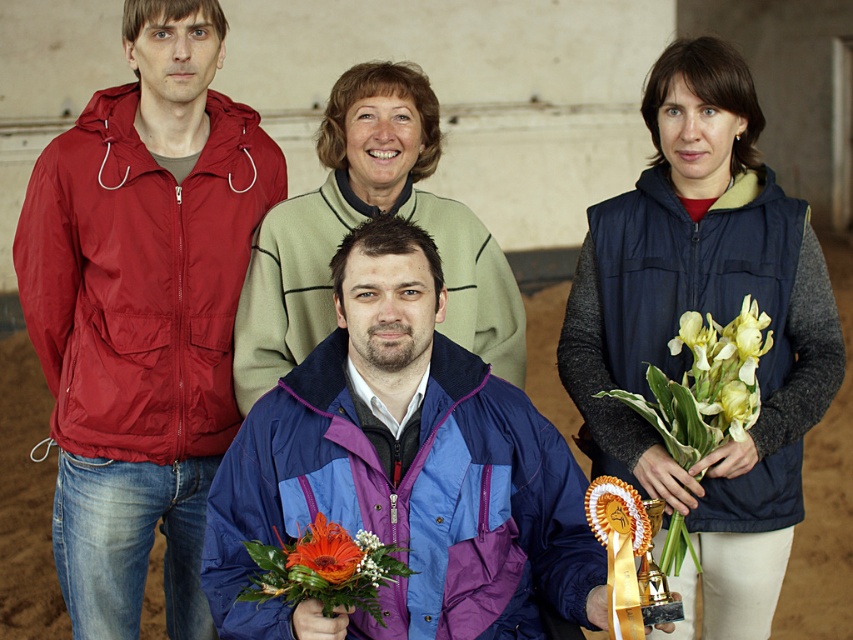
Question: Can you confirm if blue-purple nylon jacket at center is positioned below yellow-green floral bouquet at right?

Choices:
 (A) yes
 (B) no

Answer: (A)

Question: In this image, where is blue-purple nylon jacket at center located relative to matte green sweater at upper center?

Choices:
 (A) above
 (B) below

Answer: (B)

Question: Which point is farther from the camera taking this photo?

Choices:
 (A) (677, 298)
 (B) (296, 548)
 (C) (636, 401)
 (D) (363, 168)

Answer: (D)

Question: Which of the following is the farthest from the observer?

Choices:
 (A) (450, 536)
 (B) (727, 364)
 (C) (364, 609)
 (D) (602, 541)

Answer: (B)

Question: Which object is the farthest from the yellow-green petals at lower right?

Choices:
 (A) orange flower bouquet at center
 (B) matte green sweater at upper center
 (C) yellow-green floral bouquet at right

Answer: (A)

Question: Is yellow-green floral bouquet at right behind orange silk ribbon at center?

Choices:
 (A) no
 (B) yes

Answer: (B)